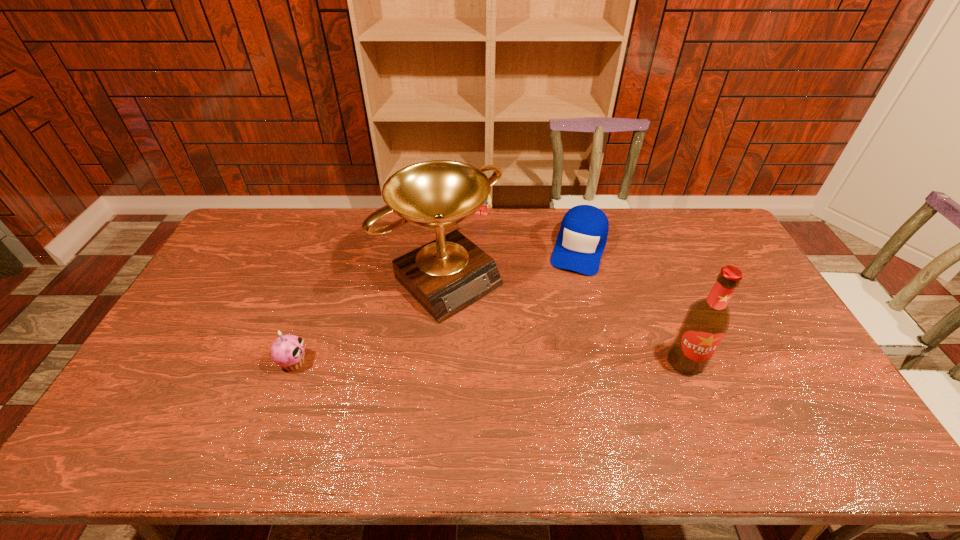
In the image, there is a desktop. Identify the location of vacant region at the near edge. (589, 403).

At what (x,y) coordinates should I click in order to perform the action: click on free location at the left edge. Please return your answer as a coordinate pair (x, y). This screenshot has height=540, width=960. Looking at the image, I should click on tap(247, 284).

Where is `free location at the right edge`? free location at the right edge is located at coordinates (726, 261).

The height and width of the screenshot is (540, 960). I want to click on vacant area at the far left corner of the desktop, so click(264, 224).

Locate an element on the screen. free spot between the cupcake and the rightmost object is located at coordinates (490, 362).

Locate an element on the screen. empty space between the cupcake and the award is located at coordinates (369, 321).

Locate an element on the screen. This screenshot has height=540, width=960. free space between the award and the rightmost object is located at coordinates (564, 321).

The height and width of the screenshot is (540, 960). What are the coordinates of `vacant space that's between the rightmost object and the award` in the screenshot? It's located at (564, 321).

You are a GUI agent. You are given a task and a screenshot of the screen. Output one action in this format:
    pyautogui.click(x=<x>, y=<y>)
    Task: Click on the free space between the baseball cap and the award
    
    Given the screenshot: What is the action you would take?
    pyautogui.click(x=512, y=264)

The width and height of the screenshot is (960, 540). What are the coordinates of `vacant area that lies between the award and the beer bottle` in the screenshot? It's located at (564, 321).